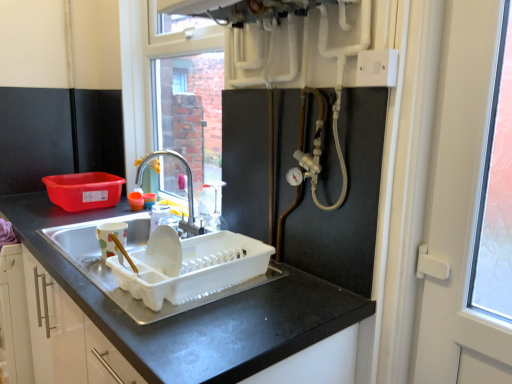
Question: Should I look upward or downward to see white plastic dish rack at sink, the 1th appliance when ordered from right to left?

Choices:
 (A) up
 (B) down

Answer: (B)

Question: Considering the relative sizes of matte ceramic mug at left, the second appliance when ordered from right to left, and white plastic screen door at right in the image provided, is matte ceramic mug at left, the second appliance when ordered from right to left, bigger than white plastic screen door at right?

Choices:
 (A) no
 (B) yes

Answer: (A)

Question: Considering the relative sizes of matte ceramic mug at left, the second appliance when ordered from right to left, and white plastic screen door at right in the image provided, is matte ceramic mug at left, the second appliance when ordered from right to left, wider than white plastic screen door at right?

Choices:
 (A) yes
 (B) no

Answer: (A)

Question: Does matte ceramic mug at left, arranged as the first appliance when viewed from the left, appear on the left side of white plastic screen door at right?

Choices:
 (A) yes
 (B) no

Answer: (A)

Question: From the image's perspective, is matte ceramic mug at left, arranged as the first appliance when viewed from the left, over white plastic screen door at right?

Choices:
 (A) yes
 (B) no

Answer: (B)

Question: From a real-world perspective, is matte ceramic mug at left, arranged as the first appliance when viewed from the left, below white plastic screen door at right?

Choices:
 (A) no
 (B) yes

Answer: (B)

Question: Does matte ceramic mug at left, arranged as the first appliance when viewed from the left, appear on the right side of white plastic screen door at right?

Choices:
 (A) yes
 (B) no

Answer: (B)

Question: From the image's perspective, is white plastic electric outlet at upper right under white plastic dish rack at sink, which is the second appliance in left-to-right order?

Choices:
 (A) no
 (B) yes

Answer: (A)

Question: From the image's perspective, does white plastic electric outlet at upper right appear higher than white plastic dish rack at sink, which is the second appliance in left-to-right order?

Choices:
 (A) no
 (B) yes

Answer: (B)

Question: Is white plastic electric outlet at upper right directly adjacent to white plastic dish rack at sink, which is the second appliance in left-to-right order?

Choices:
 (A) yes
 (B) no

Answer: (B)

Question: Is white plastic electric outlet at upper right positioned behind white plastic dish rack at sink, which is the second appliance in left-to-right order?

Choices:
 (A) yes
 (B) no

Answer: (B)

Question: Can you confirm if white plastic electric outlet at upper right is thinner than white plastic dish rack at sink, the 1th appliance when ordered from right to left?

Choices:
 (A) yes
 (B) no

Answer: (A)

Question: Does white plastic electric outlet at upper right lie in front of white plastic dish rack at sink, the 1th appliance when ordered from right to left?

Choices:
 (A) no
 (B) yes

Answer: (B)

Question: From a real-world perspective, is brushed metal faucet at center beneath white plastic screen door at right?

Choices:
 (A) no
 (B) yes

Answer: (B)